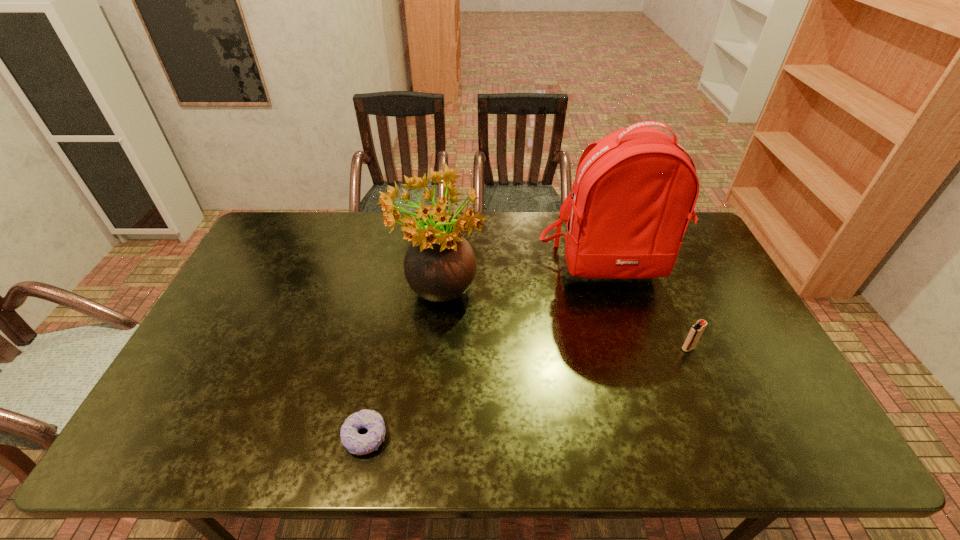
You are a GUI agent. You are given a task and a screenshot of the screen. Output one action in this format:
    pyautogui.click(x=<x>, y=<y>)
    Task: Click on the object that ranks as the second closest to the nearest object
    
    Given the screenshot: What is the action you would take?
    pyautogui.click(x=635, y=190)

The height and width of the screenshot is (540, 960). I want to click on vacant space that satisfies the following two spatial constraints: 1. on the back side of the shortest object; 2. on the left side of the third shortest object, so click(394, 297).

Where is `vacant space that satisfies the following two spatial constraints: 1. on the main compartment of the second shortest object; 2. on the right side of the tallest object`? vacant space that satisfies the following two spatial constraints: 1. on the main compartment of the second shortest object; 2. on the right side of the tallest object is located at coordinates pyautogui.click(x=634, y=348).

At what (x,y) coordinates should I click in order to perform the action: click on vacant space that satisfies the following two spatial constraints: 1. on the back side of the shortest object; 2. on the left side of the second tallest object. Please return your answer as a coordinate pair (x, y). Looking at the image, I should click on (394, 297).